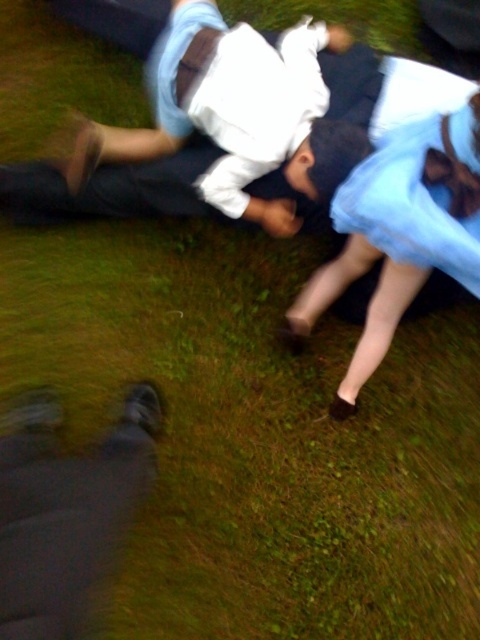
You are a photographer trying to capture a clear image of both the light blue satin dress at center and the light blue satin dress at upper right. Since the scene is slightly blurred, you need to adjust your focus. Which dress should you focus on first to ensure the wider one is sharp?

The light blue satin dress at center is wider than the light blue satin dress at upper right. To ensure the wider one is sharp, focus on the light blue satin dress at center first.

You are a photographer trying to capture a candid shot of the scene. You notice the dark gray pants at lower left and the light blue satin dress at center. Which object should you focus on first if you want to capture the leftmost element in the frame?

The dark gray pants at lower left should be focused on first since it is positioned to the left of the light blue satin dress at center, making it the leftmost element in the frame.